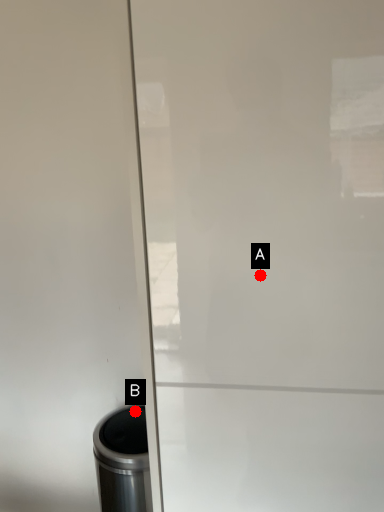
Question: Two points are circled on the image, labeled by A and B beside each circle. Which point is farther from the camera taking this photo?

Choices:
 (A) A is further
 (B) B is further

Answer: (B)